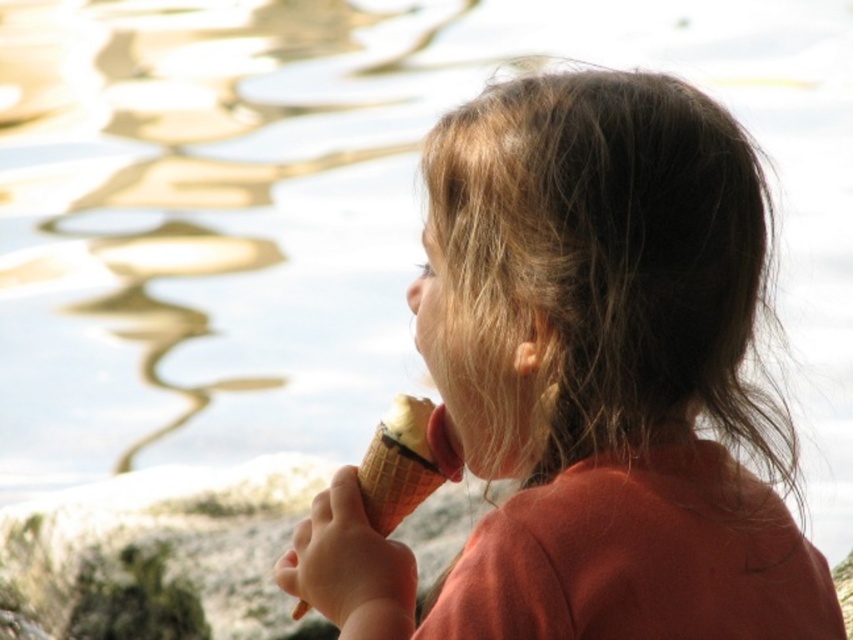
Measure the distance from smooth gray rock at lower left to vanilla ice cream in waffle cone at lower center.

The distance of smooth gray rock at lower left from vanilla ice cream in waffle cone at lower center is 3.96 meters.

You are a GUI agent. You are given a task and a screenshot of the screen. Output one action in this format:
    pyautogui.click(x=<x>, y=<y>)
    Task: Click on the smooth gray rock at lower left
    Image resolution: width=853 pixels, height=640 pixels.
    Given the screenshot: What is the action you would take?
    (x=170, y=536)

Where is `smooth gray rock at lower left`? The height and width of the screenshot is (640, 853). smooth gray rock at lower left is located at coordinates (170, 536).

Find the location of a particular element. The width and height of the screenshot is (853, 640). smooth gray rock at lower left is located at coordinates (170, 536).

You are a GUI agent. You are given a task and a screenshot of the screen. Output one action in this format:
    pyautogui.click(x=<x>, y=<y>)
    Task: Click on the matte brown ice cream cone at center
    
    Given the screenshot: What is the action you would take?
    pyautogui.click(x=587, y=381)

Does point (582, 173) come behind point (248, 474)?

No, (582, 173) is closer to viewer.

Where is `matte brown ice cream cone at center`? The image size is (853, 640). matte brown ice cream cone at center is located at coordinates (587, 381).

This screenshot has height=640, width=853. What do you see at coordinates (587, 381) in the screenshot? I see `matte brown ice cream cone at center` at bounding box center [587, 381].

Where is `matte brown ice cream cone at center`? matte brown ice cream cone at center is located at coordinates (587, 381).

Identify the location of matte brown ice cream cone at center. The image size is (853, 640). (587, 381).